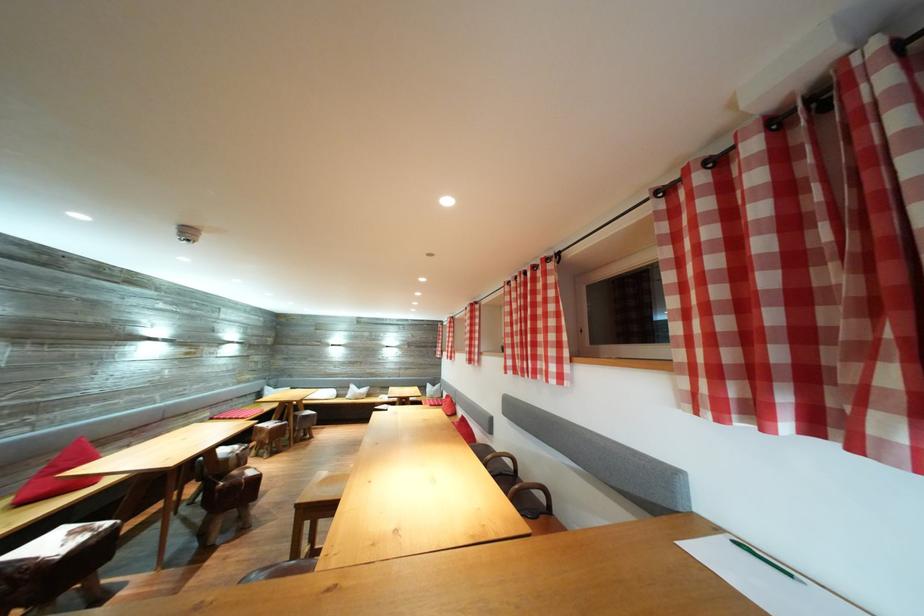
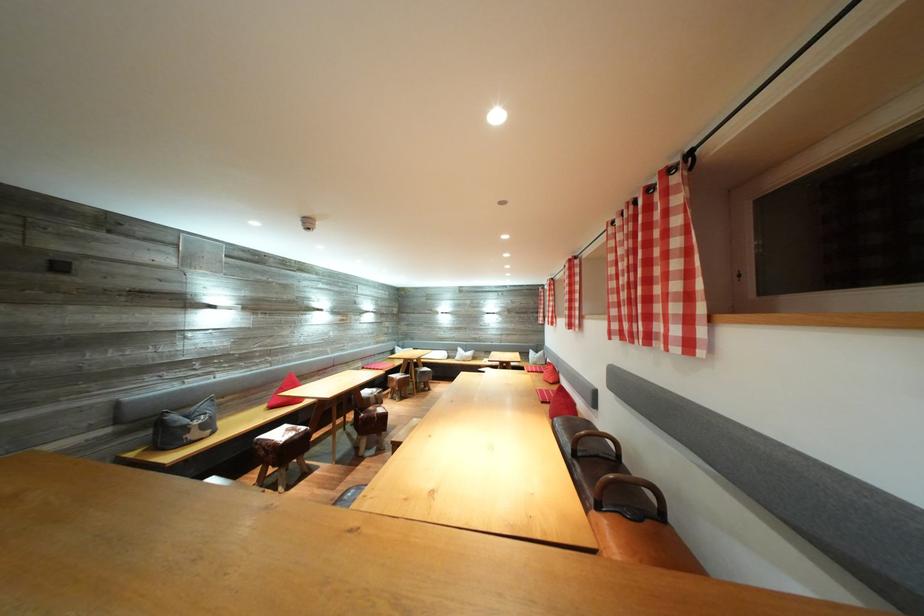
Where in the second image is the point corresponding to point (359, 392) from the first image?

(467, 355)